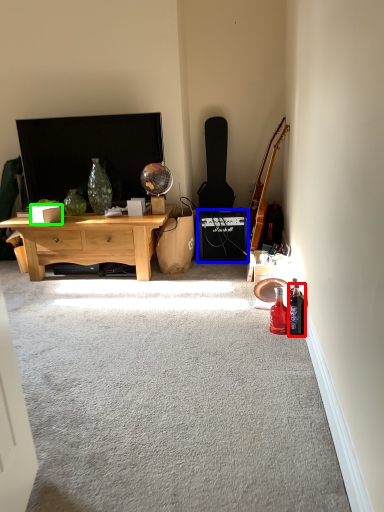
Question: Based on their relative distances, which object is farther from bottle (highlighted by a red box)? Choose from loudspeaker (highlighted by a blue box) and box (highlighted by a green box).

Choices:
 (A) loudspeaker
 (B) box

Answer: (B)